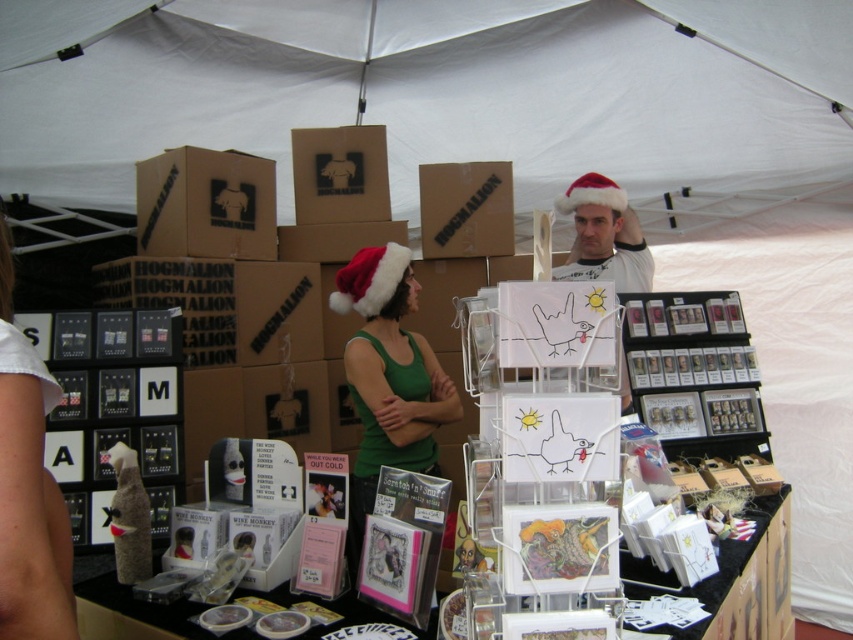
You are a customer at the market stall and want to pick up the cardboard box at upper center. However, the red velvet santa hat at center is blocking your access. Can you move the hat to reach the box?

The cardboard box at upper center is positioned under the red velvet santa hat at center, so you would need to move the hat to access the box.

You are a customer at the market stall. You notice the cardboard box at upper center and the red velvet santa hat at center. Which item is taller?

The cardboard box at upper center is taller than the red velvet santa hat at center.

You are a customer at the market stall and want to place the red velvet santa hat at center on top of the cardboard box at upper center. Based on their sizes, do you think this will be possible?

The cardboard box at upper center might be wider than red velvet santa hat at center, so it is possible that the hat can be placed on top as long as its width is sufficient to support it.